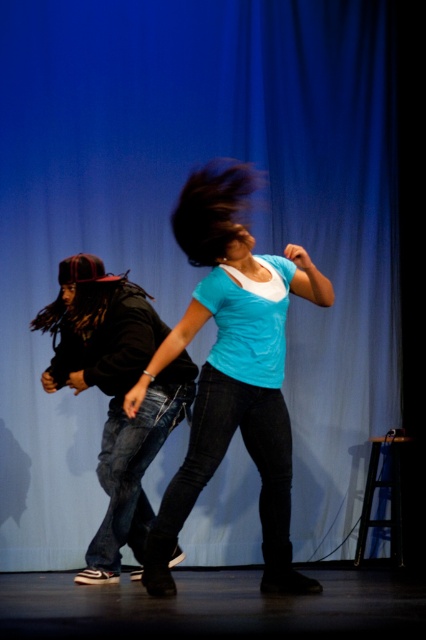
Question: In this image, where is matte blue t-shirt at center located relative to denim jeans at left?

Choices:
 (A) above
 (B) below

Answer: (A)

Question: Is matte blue t-shirt at center wider than denim jeans at left?

Choices:
 (A) no
 (B) yes

Answer: (B)

Question: Which of the following is the farthest from the observer?

Choices:
 (A) (227, 257)
 (B) (74, 362)

Answer: (B)

Question: Is matte blue t-shirt at center positioned in front of denim jeans at left?

Choices:
 (A) yes
 (B) no

Answer: (A)

Question: Which object is farther from the camera taking this photo?

Choices:
 (A) denim jeans at left
 (B) matte blue t-shirt at center

Answer: (A)